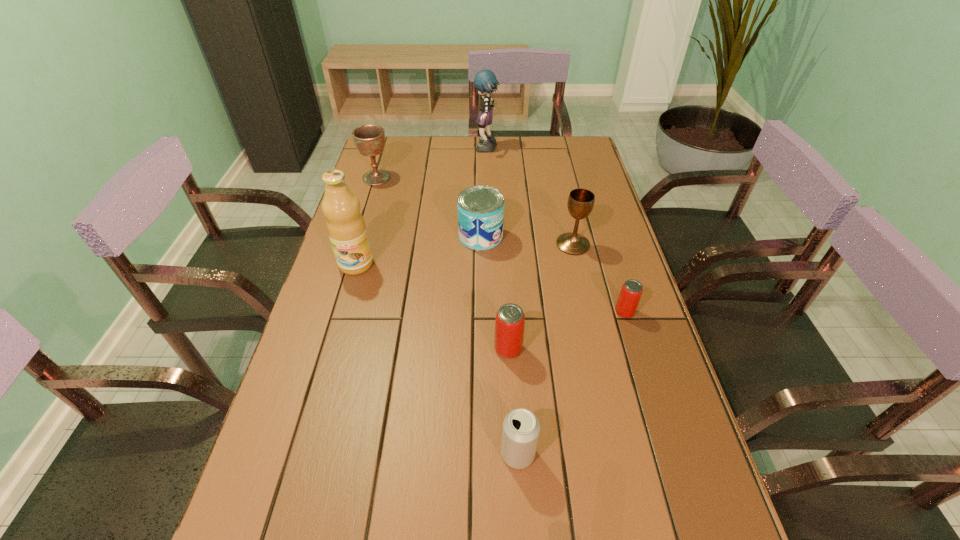
Locate which object is the second closest to the rightmost beer can. Please provide its 2D coordinates. Your answer should be formatted as a tuple, i.e. [(x, y)], where the tuple contains the x and y coordinates of a point satisfying the conditions above.

[(510, 319)]

Select which object appears as the fourth closest to the nearer pink beer can. Please provide its 2D coordinates. Your answer should be formatted as a tuple, i.e. [(x, y)], where the tuple contains the x and y coordinates of a point satisfying the conditions above.

[(580, 204)]

This screenshot has width=960, height=540. Identify the location of the second closest beer can to the left chalice. pyautogui.click(x=630, y=294).

At what (x,y) coordinates should I click in order to perform the action: click on beer can that is the third nearest to the olive oil. Please return your answer as a coordinate pair (x, y). Looking at the image, I should click on (630, 294).

Identify the location of vacant space that satisfies the following two spatial constraints: 1. on the front side of the bigger pink beer can; 2. on the right side of the nearest object. (514, 454).

Where is `blank space that satisfies the following two spatial constraints: 1. on the back side of the shortest object; 2. on the left side of the bigger pink beer can`? The image size is (960, 540). blank space that satisfies the following two spatial constraints: 1. on the back side of the shortest object; 2. on the left side of the bigger pink beer can is located at coordinates (506, 312).

Image resolution: width=960 pixels, height=540 pixels. I want to click on free location that satisfies the following two spatial constraints: 1. on the front-facing side of the rag doll; 2. on the left side of the bigger pink beer can, so click(491, 349).